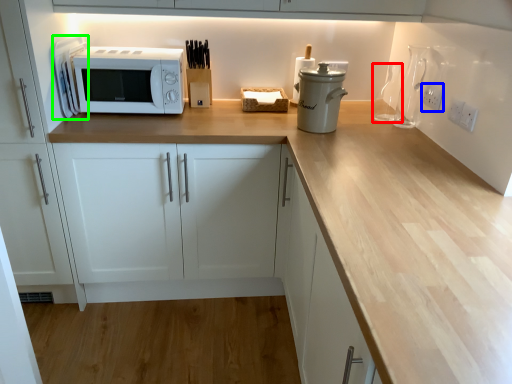
Question: Based on their relative distances, which object is nearer to bottle (highlighted by a red box)? Choose from electric outlet (highlighted by a blue box) and appliance (highlighted by a green box).

Choices:
 (A) electric outlet
 (B) appliance

Answer: (A)